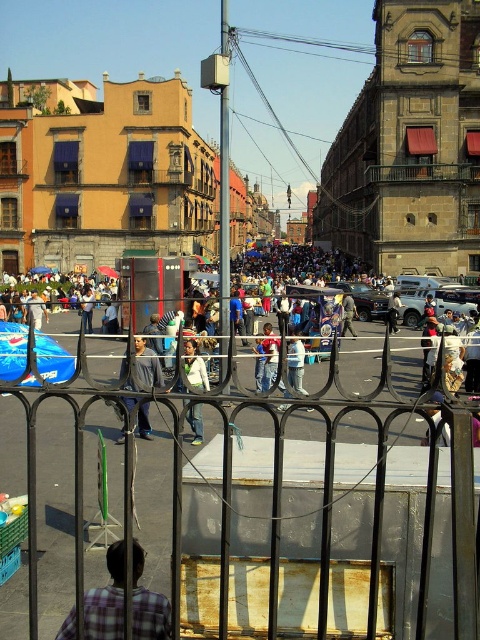
Is plaid shirt at lower left positioned at the back of white matte jacket at center?

No.

Can you confirm if plaid shirt at lower left is positioned below white matte jacket at center?

Yes.

This screenshot has height=640, width=480. I want to click on plaid shirt at lower left, so click(x=107, y=600).

Where is `plaid shirt at lower left`? The image size is (480, 640). plaid shirt at lower left is located at coordinates (107, 600).

Does denim pants at center have a larger size compared to light brown leather jacket at center?

Correct, denim pants at center is larger in size than light brown leather jacket at center.

The height and width of the screenshot is (640, 480). Identify the location of denim pants at center. (296, 364).

Between point (103, 611) and point (297, 342), which one is positioned in front?

Point (103, 611)

Is point (84, 636) positioned after point (294, 388)?

No, it is not.

The width and height of the screenshot is (480, 640). Find the location of `plaid shirt at lower left`. plaid shirt at lower left is located at coordinates (107, 600).